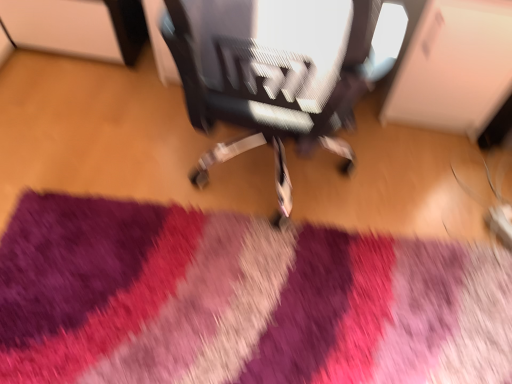
Question: Is purple shaggy rug at center a part of textured fabric chair at center?

Choices:
 (A) yes
 (B) no

Answer: (B)

Question: Is textured fabric chair at center to the right of purple shaggy rug at center from the viewer's perspective?

Choices:
 (A) no
 (B) yes

Answer: (B)

Question: Is textured fabric chair at center thinner than purple shaggy rug at center?

Choices:
 (A) no
 (B) yes

Answer: (B)

Question: Is textured fabric chair at center at the left side of purple shaggy rug at center?

Choices:
 (A) yes
 (B) no

Answer: (B)

Question: Can you see textured fabric chair at center touching purple shaggy rug at center?

Choices:
 (A) yes
 (B) no

Answer: (B)

Question: Can we say textured fabric chair at center lies outside purple shaggy rug at center?

Choices:
 (A) no
 (B) yes

Answer: (B)

Question: Is purple shaggy rug at center surrounding textured fabric chair at center?

Choices:
 (A) yes
 (B) no

Answer: (B)

Question: Considering the relative positions of purple shaggy rug at center and textured fabric chair at center in the image provided, is purple shaggy rug at center to the left of textured fabric chair at center from the viewer's perspective?

Choices:
 (A) yes
 (B) no

Answer: (A)

Question: Considering the relative positions of purple shaggy rug at center and textured fabric chair at center in the image provided, is purple shaggy rug at center to the right of textured fabric chair at center from the viewer's perspective?

Choices:
 (A) yes
 (B) no

Answer: (B)

Question: Is purple shaggy rug at center facing away from textured fabric chair at center?

Choices:
 (A) yes
 (B) no

Answer: (A)

Question: From a real-world perspective, is purple shaggy rug at center below textured fabric chair at center?

Choices:
 (A) no
 (B) yes

Answer: (B)

Question: Is purple shaggy rug at center positioned beyond the bounds of textured fabric chair at center?

Choices:
 (A) yes
 (B) no

Answer: (A)

Question: Considering the positions of purple shaggy rug at center and textured fabric chair at center in the image, is purple shaggy rug at center bigger or smaller than textured fabric chair at center?

Choices:
 (A) big
 (B) small

Answer: (B)